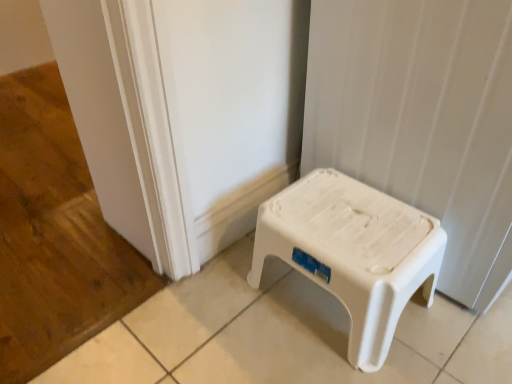
Measure the distance between white plastic stool at center and camera.

The distance of white plastic stool at center from camera is 30.44 inches.

This screenshot has height=384, width=512. I want to click on white plastic stool at center, so click(x=353, y=253).

What do you see at coordinates (353, 253) in the screenshot? I see `white plastic stool at center` at bounding box center [353, 253].

Describe the element at coordinates (422, 120) in the screenshot. This screenshot has width=512, height=384. I see `white plastic stool at lower right` at that location.

Where is `white plastic stool at lower right`? The width and height of the screenshot is (512, 384). white plastic stool at lower right is located at coordinates (422, 120).

At what (x,y) coordinates should I click in order to perform the action: click on white plastic stool at center. Please return your answer as a coordinate pair (x, y). Looking at the image, I should click on [353, 253].

Considering the relative positions of white plastic stool at center and white plastic stool at lower right in the image provided, is white plastic stool at center to the right of white plastic stool at lower right from the viewer's perspective?

Incorrect, white plastic stool at center is not on the right side of white plastic stool at lower right.

Looking at this image, which is behind, white plastic stool at center or white plastic stool at lower right?

white plastic stool at center is further away from the camera.

Which is behind, point (274, 233) or point (474, 218)?

The point (274, 233) is more distant.

From the image's perspective, which one is positioned lower, white plastic stool at center or white plastic stool at lower right?

white plastic stool at center appears lower in the image.

From a real-world perspective, which object stands above the other?

white plastic stool at lower right is physically above.

Based on the photo, looking at their sizes, would you say white plastic stool at center is wider or thinner than white plastic stool at lower right?

Considering their sizes, white plastic stool at center looks slimmer than white plastic stool at lower right.

Does white plastic stool at center have a greater height compared to white plastic stool at lower right?

In fact, white plastic stool at center may be shorter than white plastic stool at lower right.

Considering the relative sizes of white plastic stool at center and white plastic stool at lower right in the image provided, is white plastic stool at center bigger than white plastic stool at lower right?

Actually, white plastic stool at center might be smaller than white plastic stool at lower right.

Based on the photo, is white plastic stool at center positioned beyond the bounds of white plastic stool at lower right?

That's correct, white plastic stool at center is outside of white plastic stool at lower right.

Is white plastic stool at center with white plastic stool at lower right?

No.

Does white plastic stool at center turn towards white plastic stool at lower right?

No.

Identify the location of stool below the white plastic stool at lower right (from a real-world perspective). (353, 253).

Based on their positions, is white plastic stool at lower right located to the left or right of white plastic stool at center?

white plastic stool at lower right is positioned on white plastic stool at center's right side.

Relative to white plastic stool at center, is white plastic stool at lower right in front or behind?

Clearly, white plastic stool at lower right is in front of white plastic stool at center.

Does point (353, 166) appear closer or farther from the camera than point (374, 286)?

Point (353, 166) appears to be farther away from the viewer than point (374, 286).

From the image's perspective, relative to white plastic stool at center, is white plastic stool at lower right above or below?

white plastic stool at lower right is situated higher than white plastic stool at center in the image.

From a real-world perspective, is white plastic stool at lower right positioned under white plastic stool at center based on gravity?

No, from a real-world perspective, white plastic stool at lower right is not below white plastic stool at center.

In terms of width, does white plastic stool at lower right look wider or thinner when compared to white plastic stool at center?

Clearly, white plastic stool at lower right has more width compared to white plastic stool at center.

Is white plastic stool at lower right taller than white plastic stool at center?

Yes.

Is white plastic stool at lower right bigger than white plastic stool at center?

Yes, white plastic stool at lower right is bigger than white plastic stool at center.

Is white plastic stool at lower right spatially inside white plastic stool at center, or outside of it?

white plastic stool at lower right exists outside the volume of white plastic stool at center.

Is there a large distance between white plastic stool at lower right and white plastic stool at center?

That's not correct — white plastic stool at lower right is a little close to white plastic stool at center.

Is white plastic stool at center at the back of white plastic stool at lower right?

No, white plastic stool at lower right is not facing the opposite direction of white plastic stool at center.

You are a GUI agent. You are given a task and a screenshot of the screen. Output one action in this format:
    pyautogui.click(x=<x>, y=<y>)
    Task: Click on the curtain in front of the white plastic stool at center
    
    Given the screenshot: What is the action you would take?
    pyautogui.click(x=422, y=120)

What are the coordinates of `stool that is below the white plastic stool at lower right (from the image's perspective)` in the screenshot? It's located at (353, 253).

Find the location of `stool that appears behind the white plastic stool at lower right`. stool that appears behind the white plastic stool at lower right is located at coordinates (353, 253).